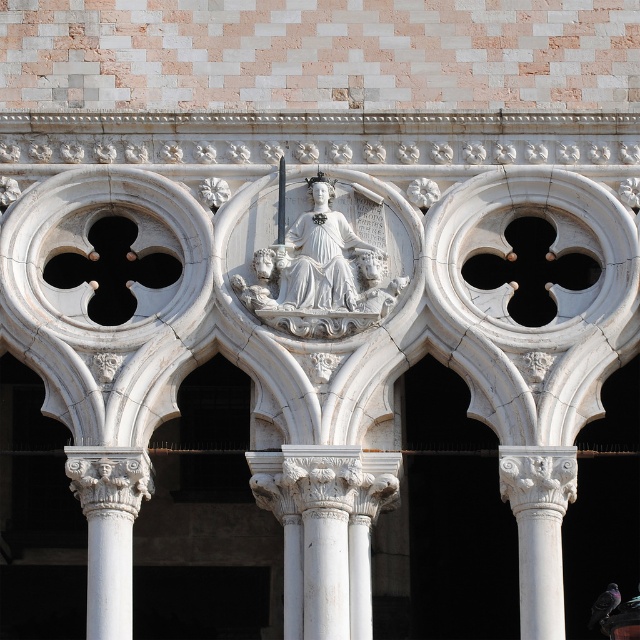
Question: Which point is farther to the camera?

Choices:
 (A) white stone statue at center
 (B) white marble column at lower left
 (C) white marble column at center

Answer: (A)

Question: Observing the image, what is the correct spatial positioning of white marble column at center in reference to white marble column at lower left?

Choices:
 (A) above
 (B) below

Answer: (A)

Question: Which point is closer to the camera?

Choices:
 (A) white marble column at right
 (B) white stone statue at center
 (C) white marble column at lower left
 (D) white marble column at center

Answer: (C)

Question: Is white stone statue at center to the right of white marble column at right from the viewer's perspective?

Choices:
 (A) no
 (B) yes

Answer: (A)

Question: Does white marble column at center appear over white marble column at right?

Choices:
 (A) no
 (B) yes

Answer: (B)

Question: Among these objects, which one is farthest from the camera?

Choices:
 (A) white marble column at lower left
 (B) white stone statue at center

Answer: (B)